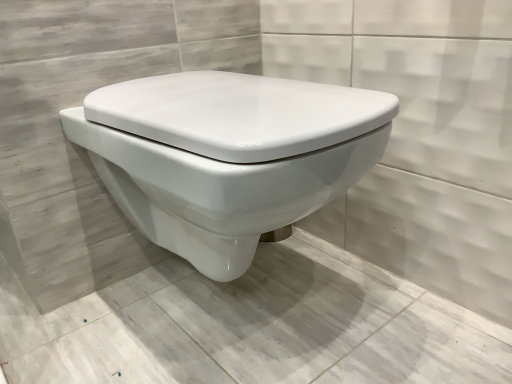
Question: Is white glossy toilet at center located outside white glossy toilet at center?

Choices:
 (A) yes
 (B) no

Answer: (A)

Question: Can you confirm if white glossy toilet at center is thinner than white glossy toilet at center?

Choices:
 (A) yes
 (B) no

Answer: (A)

Question: From a real-world perspective, is white glossy toilet at center located higher than white glossy toilet at center?

Choices:
 (A) yes
 (B) no

Answer: (A)

Question: Is white glossy toilet at center closer to the viewer compared to white glossy toilet at center?

Choices:
 (A) no
 (B) yes

Answer: (A)

Question: Is the position of white glossy toilet at center more distant than that of white glossy toilet at center?

Choices:
 (A) no
 (B) yes

Answer: (B)

Question: Is white glossy toilet at center located within white glossy toilet at center?

Choices:
 (A) yes
 (B) no

Answer: (B)

Question: Would you consider white glossy toilet at center to be distant from white glossy toilet at center?

Choices:
 (A) no
 (B) yes

Answer: (A)

Question: Is white glossy toilet at center thinner than white glossy toilet at center?

Choices:
 (A) yes
 (B) no

Answer: (B)

Question: Are white glossy toilet at center and white glossy toilet at center making contact?

Choices:
 (A) yes
 (B) no

Answer: (B)

Question: Can you confirm if white glossy toilet at center is bigger than white glossy toilet at center?

Choices:
 (A) yes
 (B) no

Answer: (B)

Question: Considering the relative sizes of white glossy toilet at center and white glossy toilet at center in the image provided, is white glossy toilet at center shorter than white glossy toilet at center?

Choices:
 (A) yes
 (B) no

Answer: (A)

Question: Does white glossy toilet at center appear on the right side of white glossy toilet at center?

Choices:
 (A) yes
 (B) no

Answer: (B)

Question: In the image, is white glossy toilet at center positioned in front of or behind white glossy toilet at center?

Choices:
 (A) behind
 (B) front

Answer: (A)